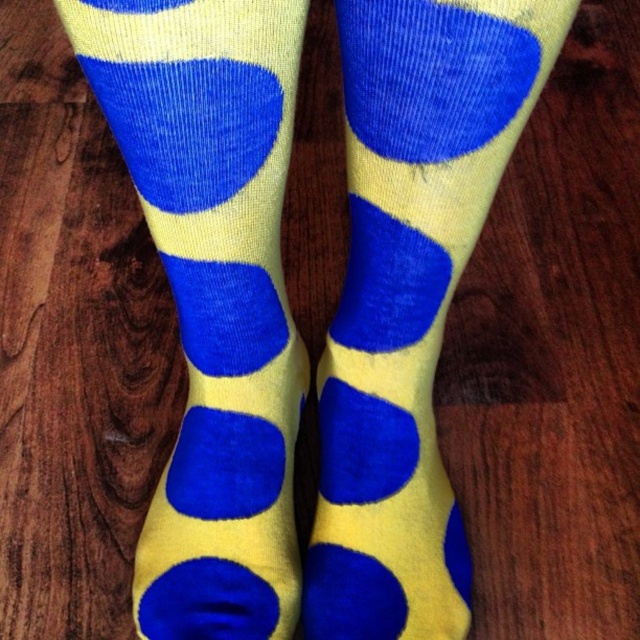
Question: Among these objects, which one is nearest to the camera?

Choices:
 (A) yellow corduroy socks at center
 (B) matte yellow socks at center

Answer: (A)

Question: Does yellow corduroy socks at center have a greater width compared to matte yellow socks at center?

Choices:
 (A) yes
 (B) no

Answer: (B)

Question: Does yellow corduroy socks at center have a lesser width compared to matte yellow socks at center?

Choices:
 (A) no
 (B) yes

Answer: (B)

Question: Can you confirm if yellow corduroy socks at center is smaller than matte yellow socks at center?

Choices:
 (A) yes
 (B) no

Answer: (A)